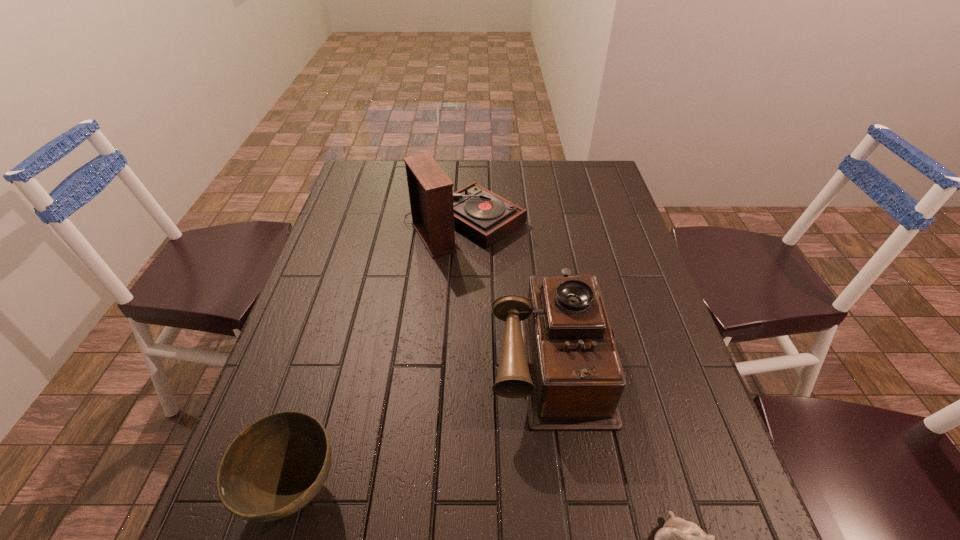
Locate an element on the screen. The width and height of the screenshot is (960, 540). the farther phonograph_record is located at coordinates (484, 216).

This screenshot has width=960, height=540. Find the location of `the second farthest object`. the second farthest object is located at coordinates (558, 350).

Where is `vacant region located 0.230m on the right of the farther phonograph_record`? This screenshot has height=540, width=960. vacant region located 0.230m on the right of the farther phonograph_record is located at coordinates (602, 224).

Locate an element on the screen. This screenshot has height=540, width=960. blank space located 0.090m on the horn of the second farthest object is located at coordinates (565, 478).

Where is `object at the far edge`? This screenshot has width=960, height=540. object at the far edge is located at coordinates (484, 216).

You are a GUI agent. You are given a task and a screenshot of the screen. Output one action in this format:
    pyautogui.click(x=<x>, y=<y>)
    Task: Click on the object that is at the right edge
    The width and height of the screenshot is (960, 540).
    Given the screenshot: What is the action you would take?
    pyautogui.click(x=558, y=350)

The image size is (960, 540). In the image, there is a desktop. In order to click on free space at the far edge in this screenshot , I will do `click(455, 178)`.

This screenshot has width=960, height=540. What are the coordinates of `vacant space at the left edge of the desktop` in the screenshot? It's located at (311, 414).

The height and width of the screenshot is (540, 960). I want to click on vacant space at the right edge, so click(663, 316).

This screenshot has width=960, height=540. I want to click on free spot between the farthest object and the second farthest object, so click(x=507, y=291).